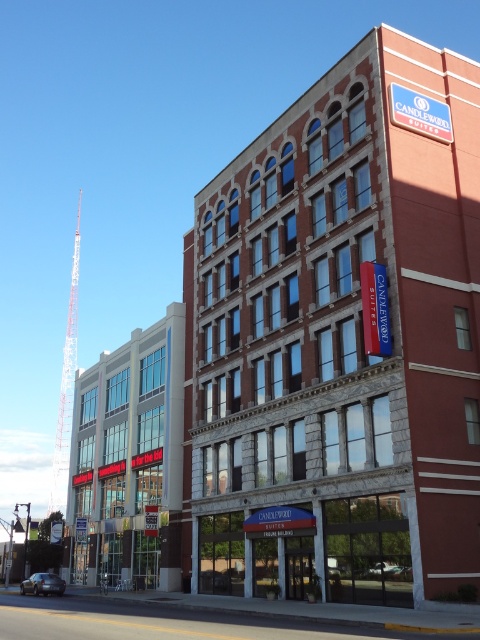
You are standing at the entrance of the city park and want to find the red brick building at center. According to the map coordinates provided, what are the coordinates where you should head towards?

The red brick building at center is located at point (344, 339), so you should head towards those coordinates.

You are a delivery person needing to find the hotel mentioned in the scene. The hotel has a sign that says Candlewood Suites. According to the scene description, which building should you head towards, the red brick building at center or the glass storefront at left?

The red brick building at center is the one with the sign reading Candlewood Suites, so you should head towards the red brick building at center.